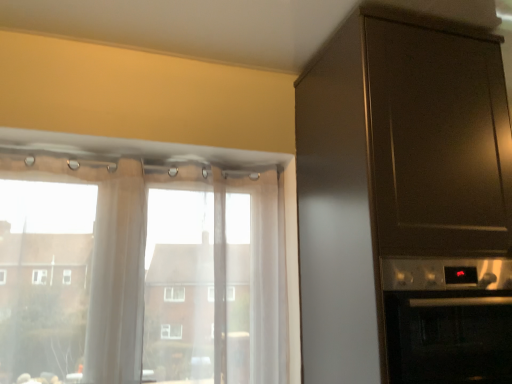
Question: Does sheer white curtain at left turn towards translucent fabric at left?

Choices:
 (A) yes
 (B) no

Answer: (A)

Question: Does sheer white curtain at left have a larger size compared to translucent fabric at left?

Choices:
 (A) yes
 (B) no

Answer: (B)

Question: Considering the relative sizes of sheer white curtain at left and translucent fabric at left in the image provided, is sheer white curtain at left shorter than translucent fabric at left?

Choices:
 (A) no
 (B) yes

Answer: (B)

Question: Can you see sheer white curtain at left touching translucent fabric at left?

Choices:
 (A) yes
 (B) no

Answer: (B)

Question: From a real-world perspective, is sheer white curtain at left below translucent fabric at left?

Choices:
 (A) yes
 (B) no

Answer: (B)

Question: Is sheer white curtain at left in front of or behind metallic dark brown cabinet at right in the image?

Choices:
 (A) behind
 (B) front

Answer: (A)

Question: Which is correct: sheer white curtain at left is inside metallic dark brown cabinet at right, or outside of it?

Choices:
 (A) outside
 (B) inside

Answer: (A)

Question: Is sheer white curtain at left wider or thinner than metallic dark brown cabinet at right?

Choices:
 (A) thin
 (B) wide

Answer: (A)

Question: Considering the positions of sheer white curtain at left and metallic dark brown cabinet at right in the image, is sheer white curtain at left bigger or smaller than metallic dark brown cabinet at right?

Choices:
 (A) small
 (B) big

Answer: (A)

Question: Is point (237, 334) closer or farther from the camera than point (465, 317)?

Choices:
 (A) farther
 (B) closer

Answer: (A)

Question: Is translucent fabric at left situated inside satin silver oven at right or outside?

Choices:
 (A) inside
 (B) outside

Answer: (B)

Question: In the image, is translucent fabric at left on the left side or the right side of satin silver oven at right?

Choices:
 (A) right
 (B) left

Answer: (B)

Question: Considering the positions of translucent fabric at left and satin silver oven at right in the image, is translucent fabric at left wider or thinner than satin silver oven at right?

Choices:
 (A) thin
 (B) wide

Answer: (A)

Question: Considering the relative positions of satin silver oven at right and translucent fabric at left in the image provided, is satin silver oven at right to the left or to the right of translucent fabric at left?

Choices:
 (A) right
 (B) left

Answer: (A)

Question: Is satin silver oven at right inside the boundaries of translucent fabric at left, or outside?

Choices:
 (A) inside
 (B) outside

Answer: (B)